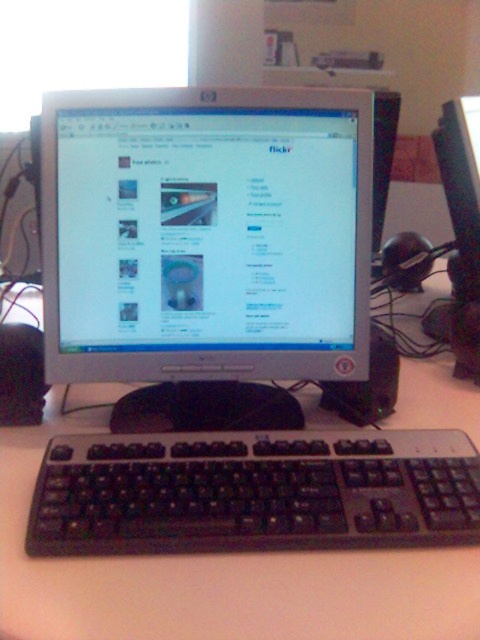
Based on the photo, can you confirm if black plastic keyboard at lower center is shorter than white plastic computer desk at center?

Correct, black plastic keyboard at lower center is not as tall as white plastic computer desk at center.

Can you confirm if black plastic keyboard at lower center is wider than white plastic computer desk at center?

No, black plastic keyboard at lower center is not wider than white plastic computer desk at center.

Image resolution: width=480 pixels, height=640 pixels. I want to click on black plastic keyboard at lower center, so click(x=253, y=492).

Where is `black plastic keyboard at lower center`? The width and height of the screenshot is (480, 640). black plastic keyboard at lower center is located at coordinates (x=253, y=492).

Between silver metallic monitor at center and white plastic computer desk at center, which one appears on the left side from the viewer's perspective?

From the viewer's perspective, white plastic computer desk at center appears more on the left side.

How far apart are silver metallic monitor at center and white plastic computer desk at center?

11.68 inches

Does point (324, 173) come in front of point (288, 636)?

No, it is behind (288, 636).

Locate an element on the screen. The width and height of the screenshot is (480, 640). silver metallic monitor at center is located at coordinates (205, 234).

Which of these two, silver metallic monitor at center or black plastic keyboard at lower center, stands shorter?

With less height is black plastic keyboard at lower center.

Does silver metallic monitor at center appear over black plastic keyboard at lower center?

Yes.

What are the coordinates of `silver metallic monitor at center` in the screenshot? It's located at (205, 234).